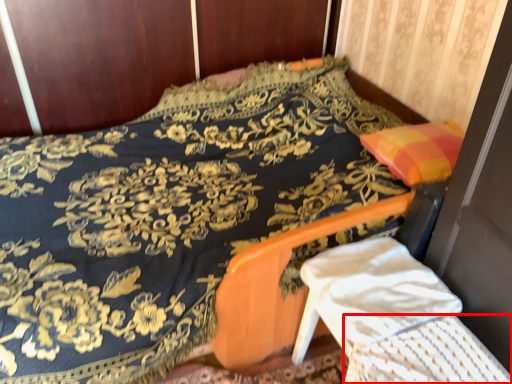
Question: From the image, what is the correct spatial relationship of blanket (annotated by the red box) in relation to armchair?

Choices:
 (A) right
 (B) left

Answer: (A)